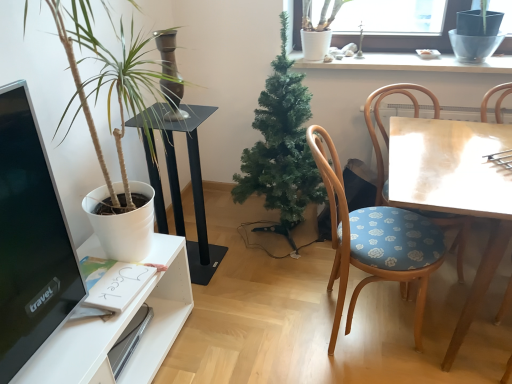
Find the location of `free space in front of green artificial tree at center, positioned as the 2th houseplant in left-to-right order`. free space in front of green artificial tree at center, positioned as the 2th houseplant in left-to-right order is located at coordinates (267, 291).